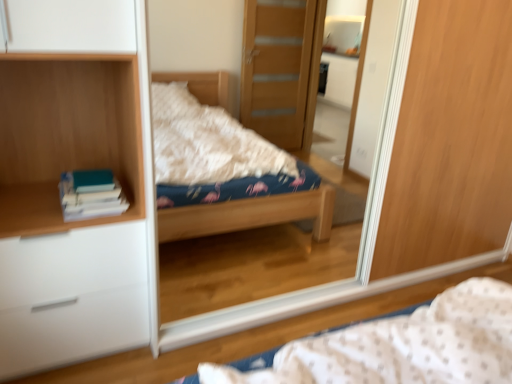
Question: Is teal matte book at left surrounded by wooden bookshelf at left?

Choices:
 (A) no
 (B) yes

Answer: (B)

Question: Does wooden bookshelf at left have a smaller size compared to teal matte book at left?

Choices:
 (A) no
 (B) yes

Answer: (A)

Question: Considering the relative sizes of wooden bookshelf at left and teal matte book at left in the image provided, is wooden bookshelf at left shorter than teal matte book at left?

Choices:
 (A) no
 (B) yes

Answer: (A)

Question: From a real-world perspective, is wooden bookshelf at left on teal matte book at left?

Choices:
 (A) yes
 (B) no

Answer: (A)

Question: From the image's perspective, would you say wooden bookshelf at left is shown under teal matte book at left?

Choices:
 (A) no
 (B) yes

Answer: (A)

Question: From the image's perspective, is wooden bookshelf at left positioned above or below wooden mirror at center?

Choices:
 (A) above
 (B) below

Answer: (A)

Question: Do you think wooden bookshelf at left is within wooden mirror at center, or outside of it?

Choices:
 (A) inside
 (B) outside

Answer: (B)

Question: Is wooden bookshelf at left bigger or smaller than wooden mirror at center?

Choices:
 (A) big
 (B) small

Answer: (B)

Question: In the image, is wooden bookshelf at left positioned in front of or behind wooden mirror at center?

Choices:
 (A) behind
 (B) front

Answer: (B)

Question: Considering the positions of point (29, 314) and point (31, 129), is point (29, 314) closer or farther from the camera than point (31, 129)?

Choices:
 (A) closer
 (B) farther

Answer: (A)

Question: From a real-world perspective, is white matte chest of drawers at left physically located above or below wooden bookshelf at left?

Choices:
 (A) below
 (B) above

Answer: (A)

Question: Based on their positions, is white matte chest of drawers at left located to the left or right of wooden bookshelf at left?

Choices:
 (A) left
 (B) right

Answer: (A)

Question: Is white matte chest of drawers at left in front of or behind wooden bookshelf at left in the image?

Choices:
 (A) behind
 (B) front

Answer: (A)

Question: Is wooden bookshelf at left taller or shorter than fluffy fabric bed at center?

Choices:
 (A) short
 (B) tall

Answer: (B)

Question: Would you say wooden bookshelf at left is to the left or to the right of fluffy fabric bed at center in the picture?

Choices:
 (A) left
 (B) right

Answer: (A)